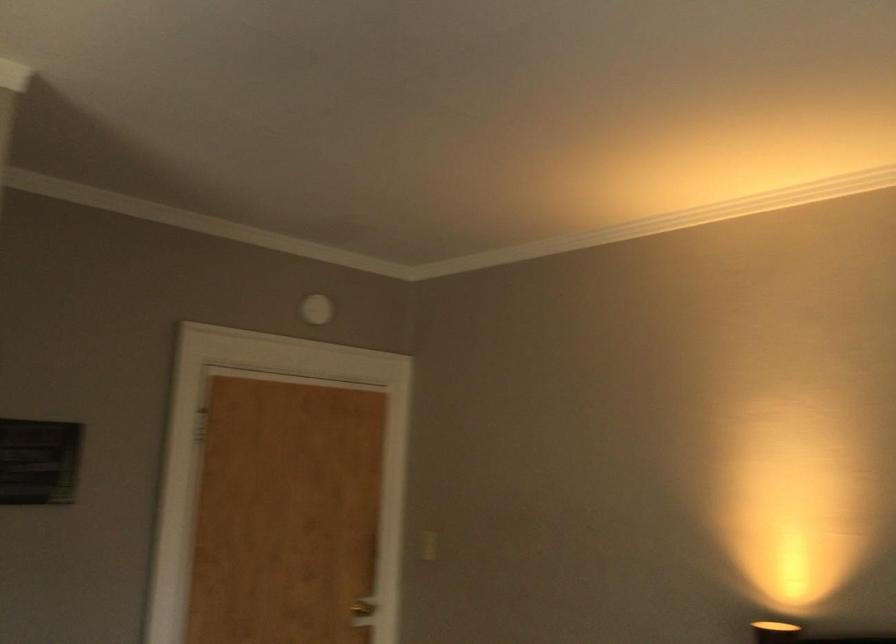
The height and width of the screenshot is (644, 896). What do you see at coordinates (427, 545) in the screenshot?
I see `the light switch` at bounding box center [427, 545].